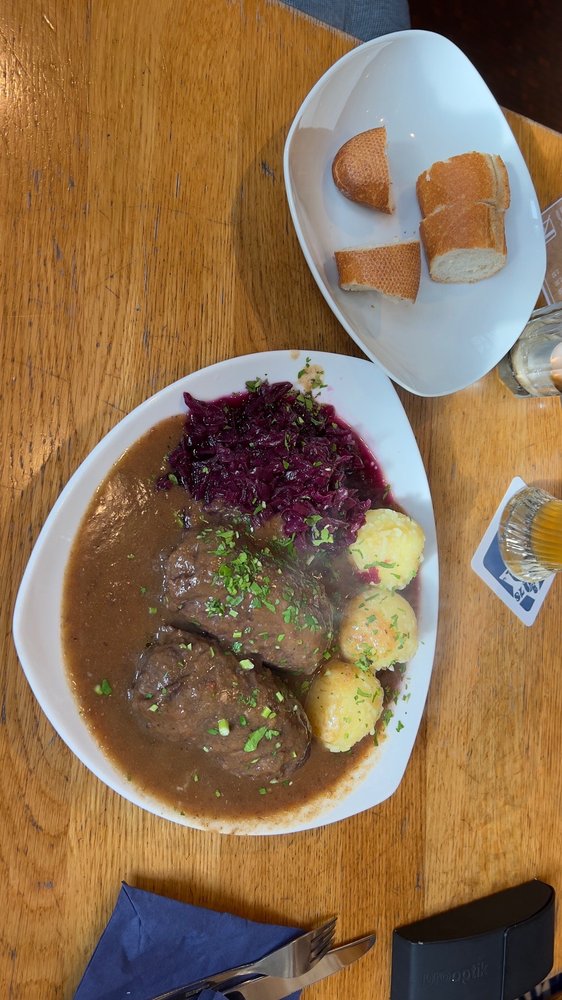
Find the location of a particular element. blue and white coaster is located at coordinates (496, 560).